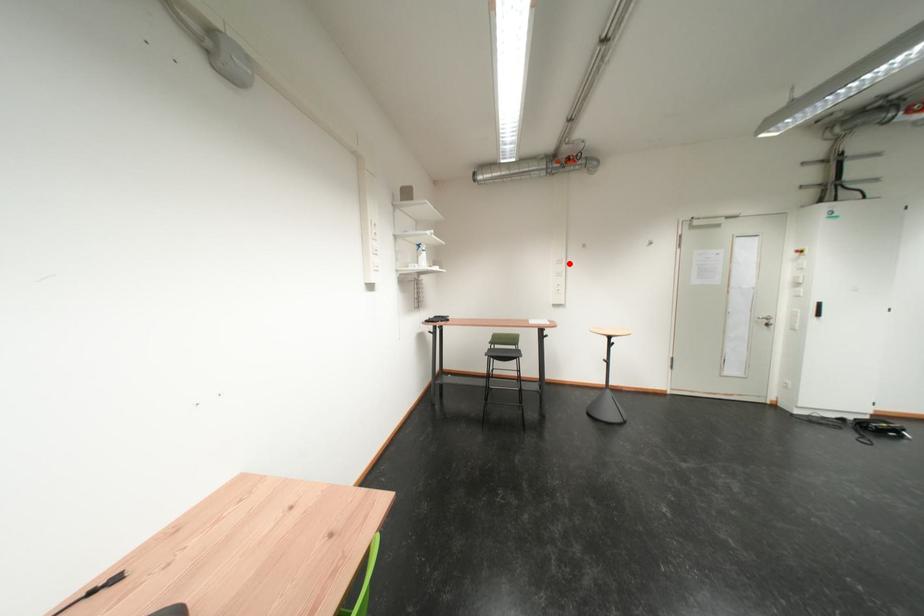
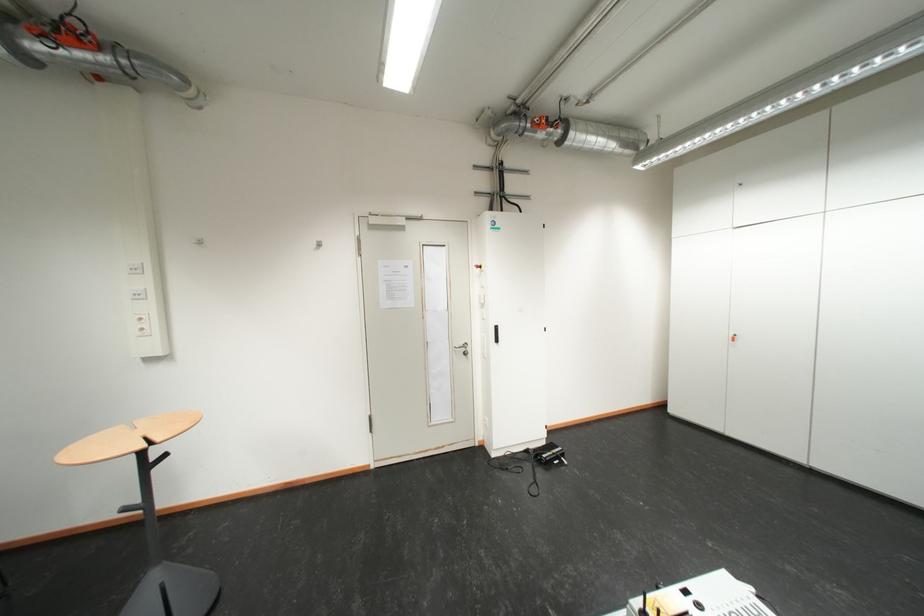
Question: I am providing you with two images of the same scene from different viewpoints. A red point is marked on the first image. Is the red point's position out of view in image 2?

Choices:
 (A) Yes
 (B) No

Answer: (B)